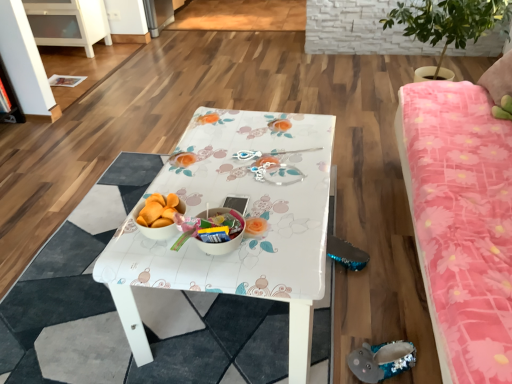
Locate an element on the screen. free space to the left of white glossy bowl at center is located at coordinates (151, 257).